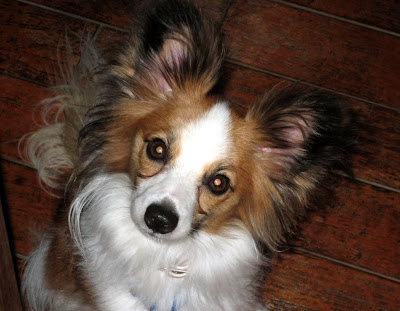
Where is `floor`? floor is located at coordinates (310, 47).